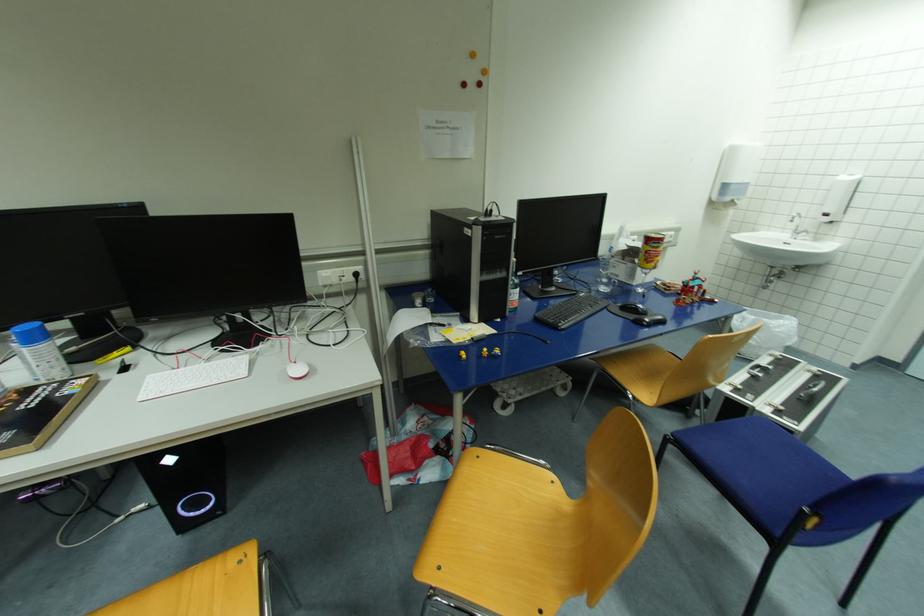
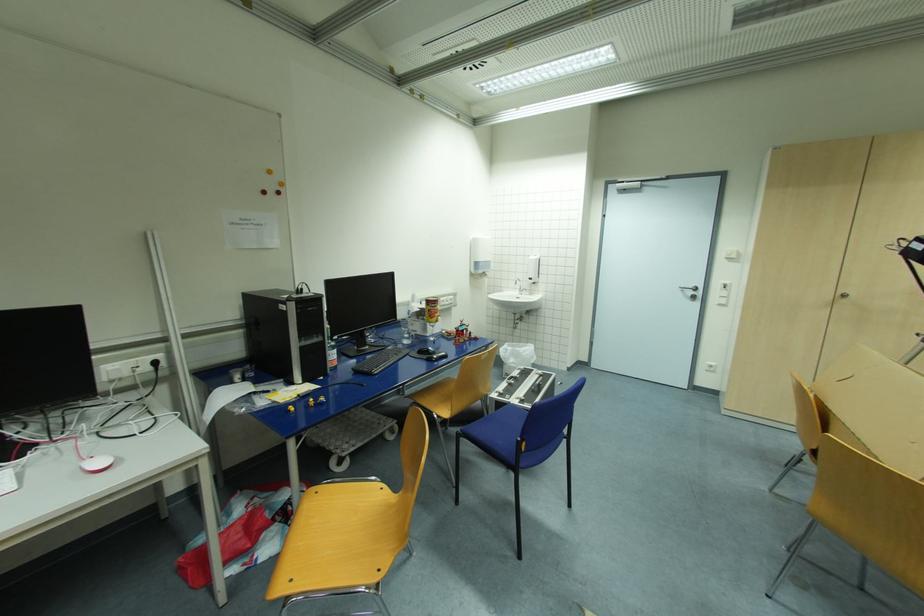
The point at (639, 309) is marked in the first image. Where is the corresponding point in the second image?

(432, 351)